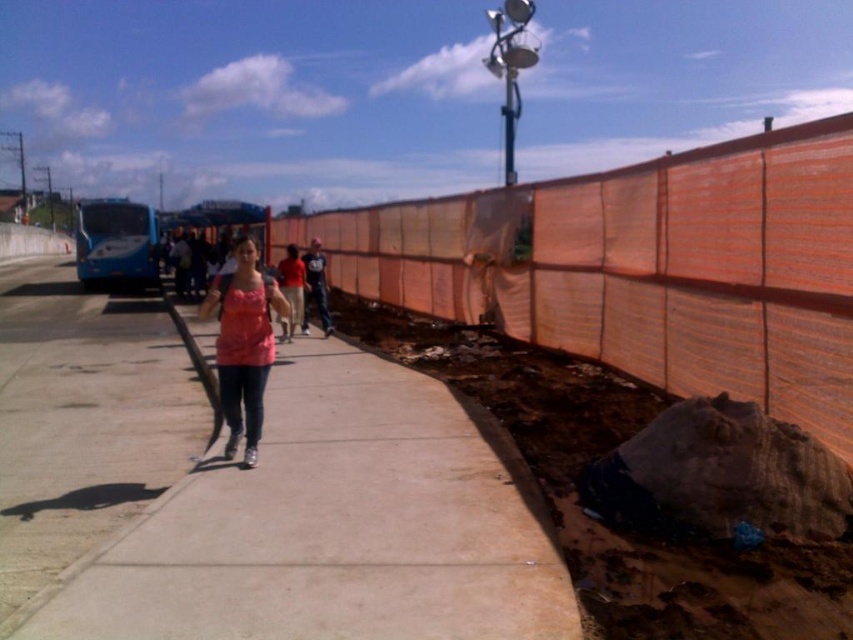
You are standing at the construction area enclosed by an orange safety fence. You want to walk to the smooth concrete sidewalk at center. Which direction should you go?

You should walk towards the direction of the smooth concrete sidewalk at center located at point (318, 524), which is to the left of your current position at the construction area.

You are a delivery drone flying above the urban scene. You need to land on the concrete sidewalk at center to drop off a package. However, you notice the matte pink tank top at center is present. Can you safely land there without hitting the person?

The concrete sidewalk at center is taller than the matte pink tank top at center, so the drone can safely land there as the sidewalk is elevated enough to avoid the person.